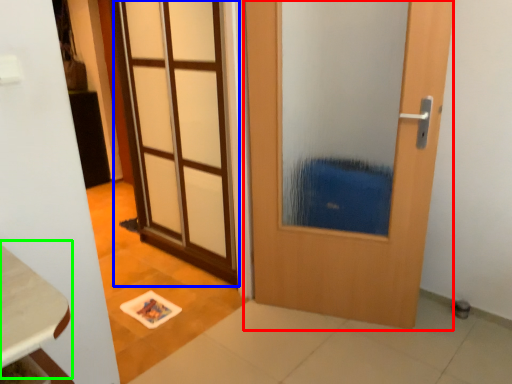
Question: Estimate the real-world distances between objects in this image. Which object is farther from door (highlighted by a red box), door (highlighted by a blue box) or table (highlighted by a green box)?

Choices:
 (A) door
 (B) table

Answer: (B)